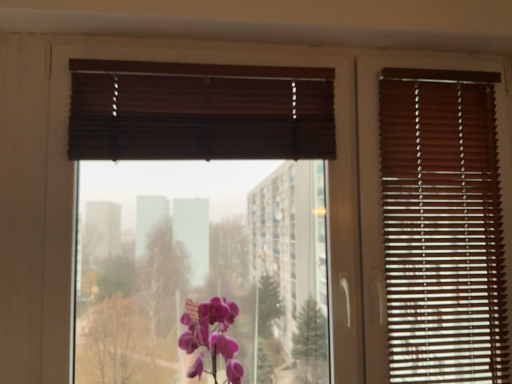
Question: From the image's perspective, is brown wood blinds at center located above purple glossy orchid at center?

Choices:
 (A) yes
 (B) no

Answer: (A)

Question: Considering the relative sizes of brown wood blinds at center and purple glossy orchid at center in the image provided, is brown wood blinds at center thinner than purple glossy orchid at center?

Choices:
 (A) no
 (B) yes

Answer: (B)

Question: Does brown wood blinds at center contain purple glossy orchid at center?

Choices:
 (A) yes
 (B) no

Answer: (B)

Question: Is brown wood blinds at center outside purple glossy orchid at center?

Choices:
 (A) no
 (B) yes

Answer: (B)

Question: Is brown wood blinds at center looking in the opposite direction of purple glossy orchid at center?

Choices:
 (A) no
 (B) yes

Answer: (A)

Question: Is brown wood blinds at center further to the viewer compared to purple glossy orchid at center?

Choices:
 (A) no
 (B) yes

Answer: (B)

Question: From a real-world perspective, is purple glossy orchid at center positioned under brown wood blinds at center based on gravity?

Choices:
 (A) no
 (B) yes

Answer: (B)

Question: Would you say purple glossy orchid at center is a long distance from brown wood blinds at center?

Choices:
 (A) no
 (B) yes

Answer: (A)

Question: Could brown wood blinds at center be considered to be inside purple glossy orchid at center?

Choices:
 (A) yes
 (B) no

Answer: (B)

Question: Is the position of purple glossy orchid at center more distant than that of brown wood blinds at center?

Choices:
 (A) no
 (B) yes

Answer: (A)

Question: Is the surface of purple glossy orchid at center in direct contact with brown wood blinds at center?

Choices:
 (A) no
 (B) yes

Answer: (A)

Question: Is purple glossy orchid at center in front of brown wood blinds at center?

Choices:
 (A) no
 (B) yes

Answer: (B)

Question: Is brown wood blinds at center inside the boundaries of purple glossy orchid at center, or outside?

Choices:
 (A) inside
 (B) outside

Answer: (B)